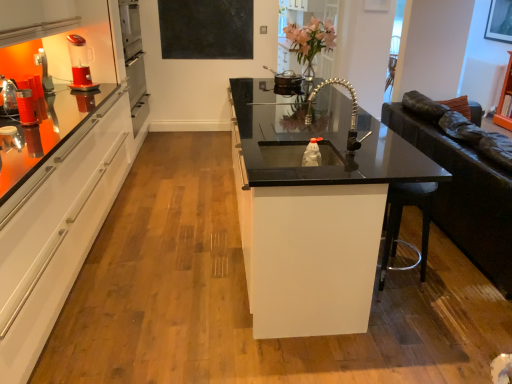
Question: From a real-world perspective, is black matte board at upper center located beneath metallic silver pot at upper center, arranged as the 2th appliance when viewed from the front?

Choices:
 (A) yes
 (B) no

Answer: (B)

Question: From the image's perspective, is black matte board at upper center on metallic silver pot at upper center, which ranks as the 1th appliance in back-to-front order?

Choices:
 (A) yes
 (B) no

Answer: (A)

Question: Would you say metallic silver pot at upper center, which ranks as the 1th appliance in back-to-front order, is part of black matte board at upper center's contents?

Choices:
 (A) no
 (B) yes

Answer: (A)

Question: Is black matte board at upper center in contact with metallic silver pot at upper center, the first appliance in the right-to-left sequence?

Choices:
 (A) yes
 (B) no

Answer: (B)

Question: From a real-world perspective, is black matte board at upper center over metallic silver pot at upper center, the second appliance positioned from the bottom?

Choices:
 (A) yes
 (B) no

Answer: (A)

Question: Is black matte board at upper center thinner than metallic silver pot at upper center, the first appliance in the right-to-left sequence?

Choices:
 (A) no
 (B) yes

Answer: (B)

Question: Is red plastic blender at upper left at the left side of matte plastic cup at left, which ranks as the 2th appliance in top-to-bottom order?

Choices:
 (A) no
 (B) yes

Answer: (B)

Question: Is red plastic blender at upper left in front of matte plastic cup at left, which is the 1th appliance in front-to-back order?

Choices:
 (A) no
 (B) yes

Answer: (A)

Question: Is matte plastic cup at left, which ranks as the 2th appliance in top-to-bottom order, a part of red plastic blender at upper left?

Choices:
 (A) no
 (B) yes

Answer: (A)

Question: Can you confirm if red plastic blender at upper left is smaller than matte plastic cup at left, the 2th appliance from the back?

Choices:
 (A) no
 (B) yes

Answer: (A)

Question: Does red plastic blender at upper left appear on the right side of matte plastic cup at left, the 2th appliance from the back?

Choices:
 (A) no
 (B) yes

Answer: (A)

Question: Does red plastic blender at upper left turn towards matte plastic cup at left, which is the 1th appliance in front-to-back order?

Choices:
 (A) no
 (B) yes

Answer: (A)

Question: Is matte plastic cup at left, marked as the first appliance in a bottom-to-top arrangement, not inside pink glass vase at upper center?

Choices:
 (A) no
 (B) yes

Answer: (B)